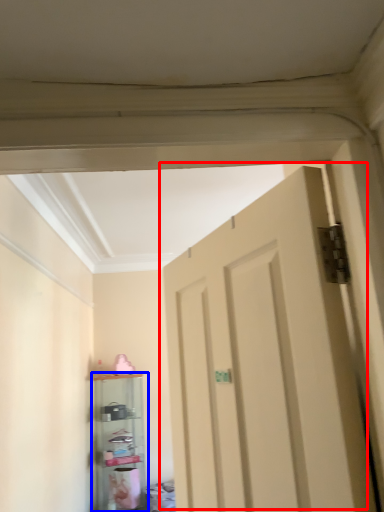
Question: Which object is closer to the camera taking this photo, door (highlighted by a red box) or shelf (highlighted by a blue box)?

Choices:
 (A) door
 (B) shelf

Answer: (A)